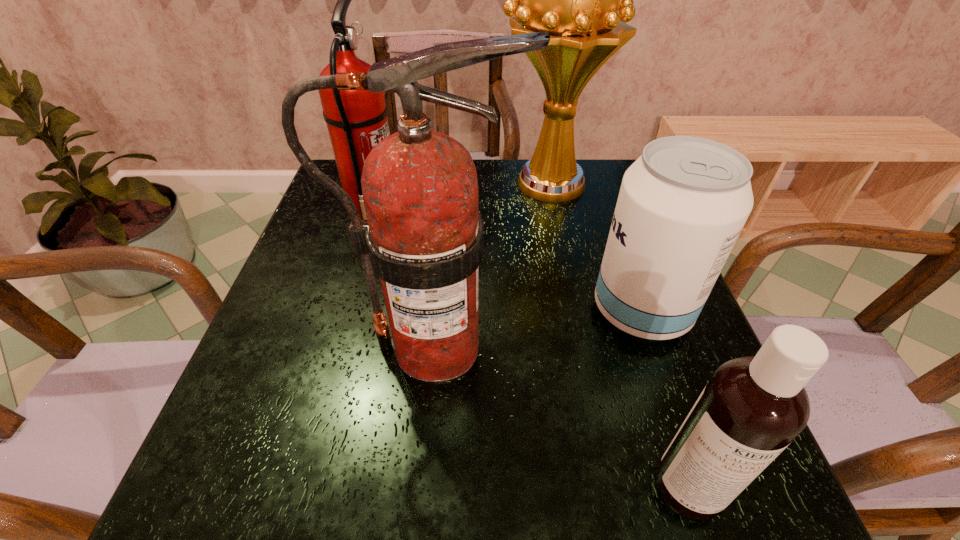
Where is `trophy_cup`? trophy_cup is located at coordinates (576, 0).

The image size is (960, 540). I want to click on the nearer fire extinguisher, so (424, 237).

You are a GUI agent. You are given a task and a screenshot of the screen. Output one action in this format:
    pyautogui.click(x=<x>, y=<y>)
    Task: Click on the farther fire extinguisher
    The height and width of the screenshot is (540, 960).
    Given the screenshot: What is the action you would take?
    pyautogui.click(x=357, y=121)

Where is `alcohol`? alcohol is located at coordinates (682, 204).

Find the location of a particular element. This screenshot has width=960, height=540. the nearest object is located at coordinates (753, 407).

Where is `vacant space located 0.370m at the front of the trophy_cup where the globe is prominent`? The width and height of the screenshot is (960, 540). vacant space located 0.370m at the front of the trophy_cup where the globe is prominent is located at coordinates (361, 184).

Locate an element on the screen. vacant space located 0.190m at the front of the trophy_cup where the globe is prominent is located at coordinates (427, 184).

At what (x,y) coordinates should I click in order to perform the action: click on free space located 0.230m at the front of the trophy_cup where the globe is prominent. Please return your answer as a coordinate pair (x, y). This screenshot has width=960, height=540. Looking at the image, I should click on (413, 184).

Locate an element on the screen. The image size is (960, 540). vacant space located 0.150m at the nozzle of the nearer fire extinguisher is located at coordinates (601, 346).

I want to click on vacant space located at the nozzle of the farther fire extinguisher, so click(x=486, y=212).